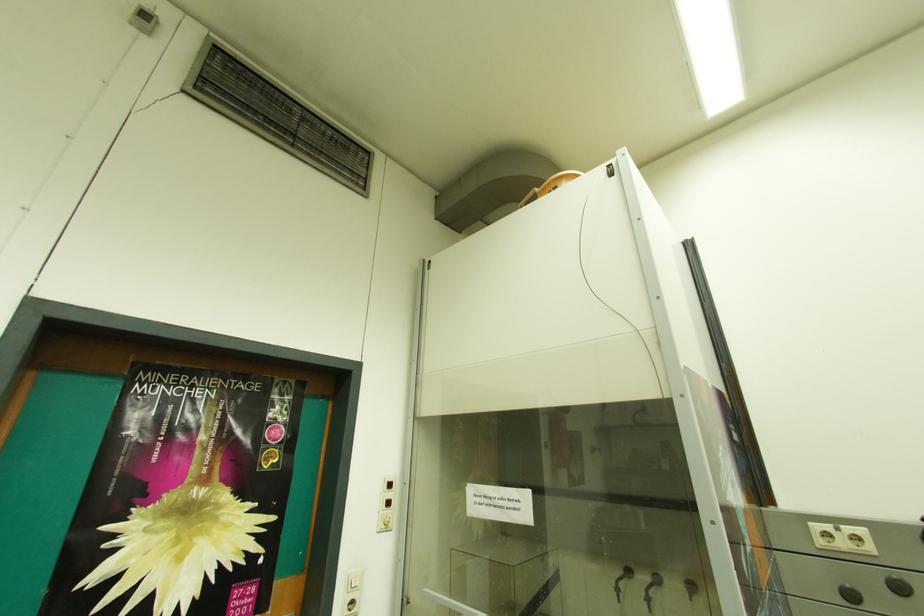
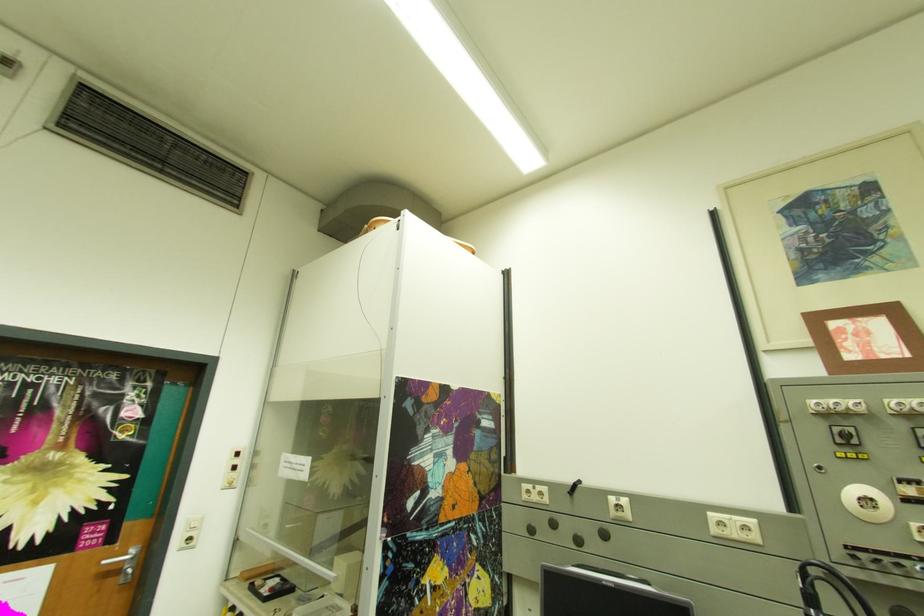
Question: The camera is either moving clockwise (left) or counter-clockwise (right) around the object. The first image is from the beginning of the video and the second image is from the end. Is the camera moving left or right when shooting the video?

Choices:
 (A) Left
 (B) Right

Answer: (A)